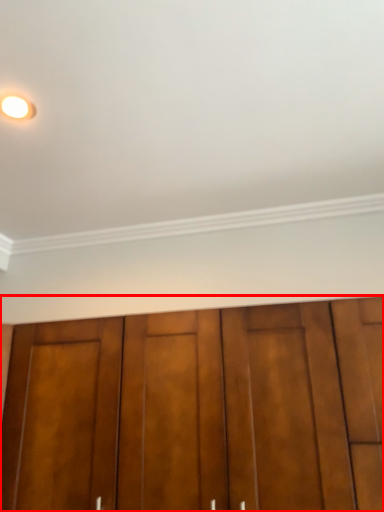
Question: In this image, where is door (annotated by the red box) located relative to lighting?

Choices:
 (A) left
 (B) right

Answer: (B)